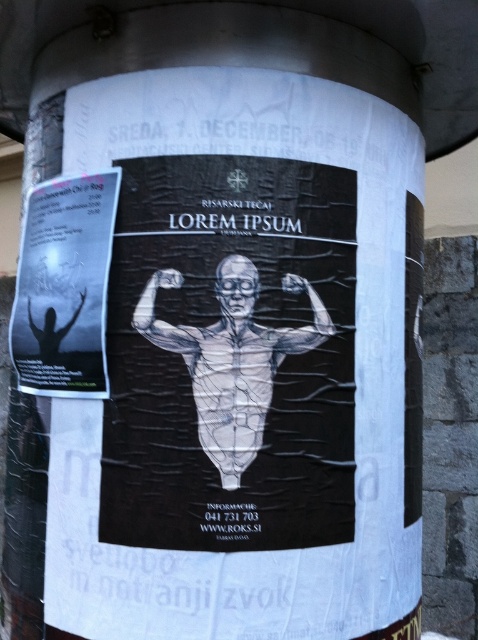
You are an artist trying to hang two items on a wall. You have a black paper poster at left and a translucent plastic figure at center. According to the scene, which object is closer to you?

The black paper poster at left is closer to you because the translucent plastic figure at center is behind it.

You are an event planner looking at the posters on the cylindrical post. You need to know the position of the black paper poster at left relative to the translucent plastic figure at center. Can you tell me if it is above or below?

The black paper poster at left is above the translucent plastic figure at center.